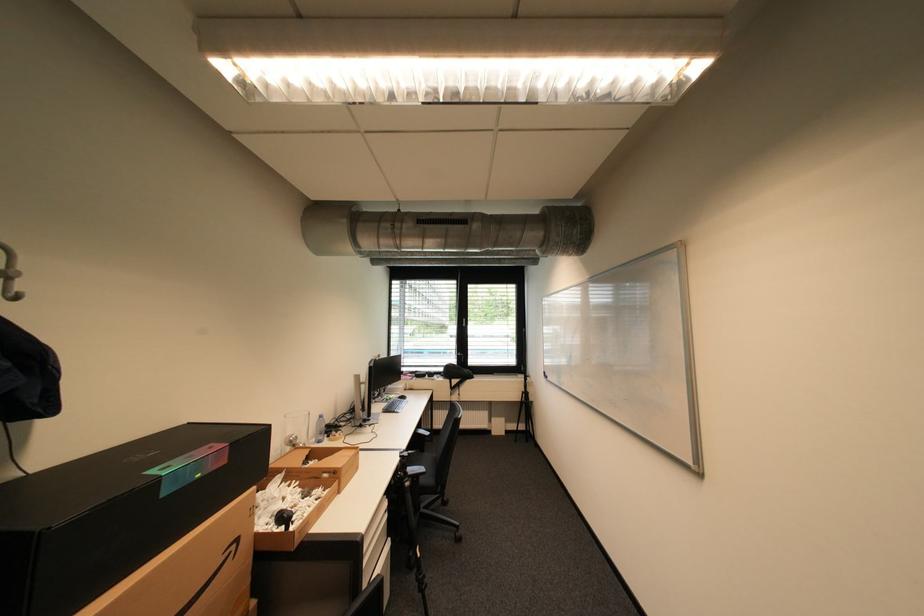
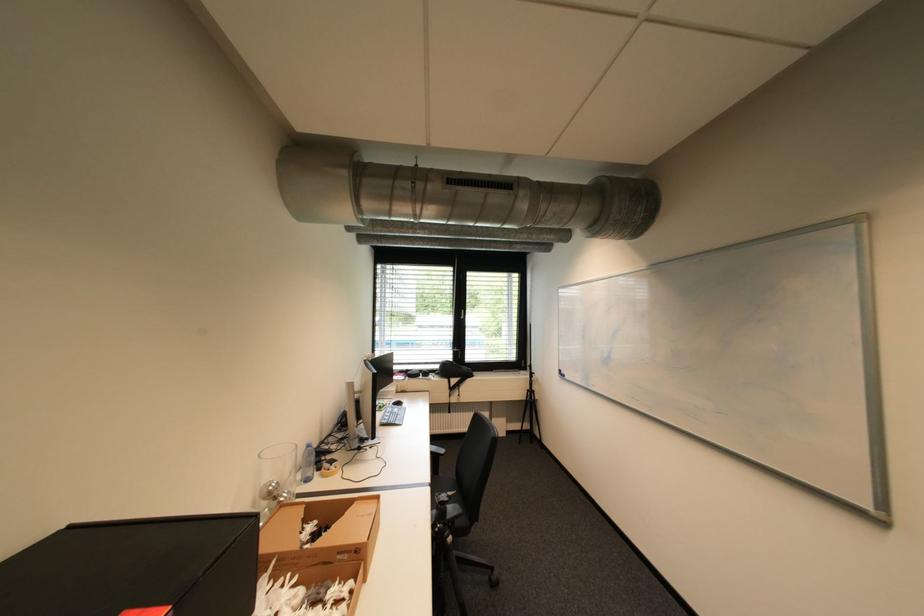
The images are taken continuously from a first-person perspective. In which direction are you moving?

The movement direction of the cameraman is left, forward.